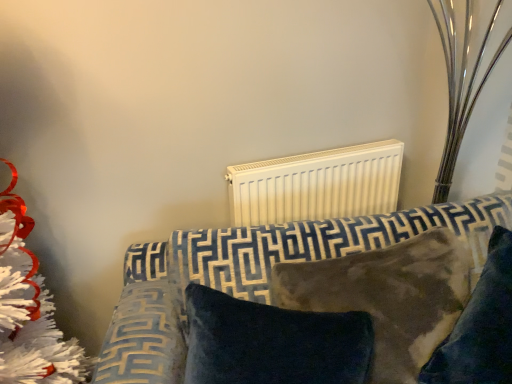
Question: Is velvety brown pillow at center, which appears as the first pillow when viewed from the right, bigger or smaller than velvet dark blue pillow at center, marked as the 2th pillow in a right-to-left arrangement?

Choices:
 (A) big
 (B) small

Answer: (A)

Question: From the image's perspective, is velvety brown pillow at center, which appears as the first pillow when viewed from the right, above or below velvet dark blue pillow at center, marked as the 2th pillow in a right-to-left arrangement?

Choices:
 (A) below
 (B) above

Answer: (B)

Question: Estimate the real-world distances between objects in this image. Which object is farther from the velvet-patterned sofa at center?

Choices:
 (A) velvet dark blue pillow at center, marked as the 2th pillow in a right-to-left arrangement
 (B) velvety brown pillow at center, the second pillow in the left-to-right sequence
 (C) white matte radiator at upper center

Answer: (C)

Question: Which of these objects is positioned farthest from the velvet dark blue pillow at center, marked as the 2th pillow in a right-to-left arrangement?

Choices:
 (A) velvety brown pillow at center, the second pillow in the left-to-right sequence
 (B) white matte radiator at upper center
 (C) velvet-patterned sofa at center

Answer: (B)